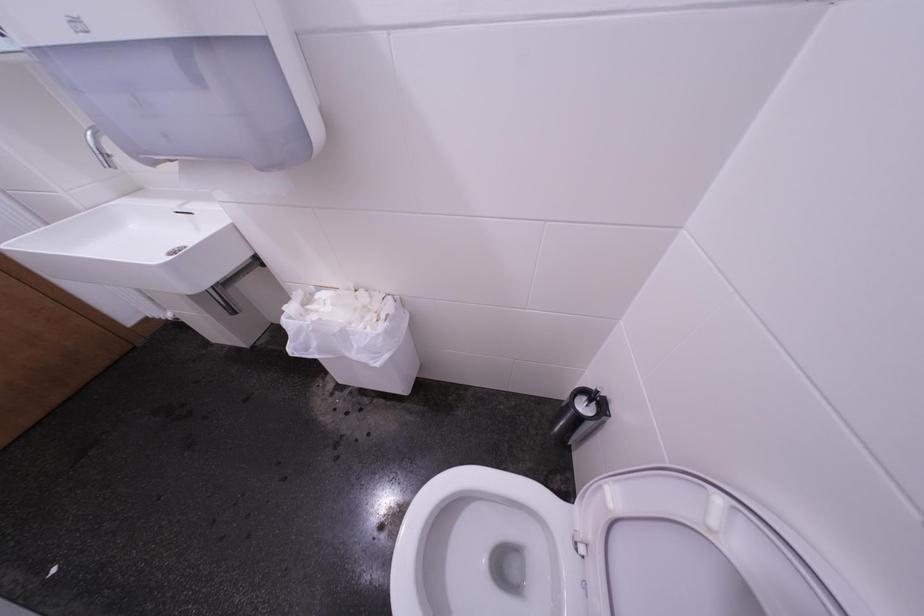
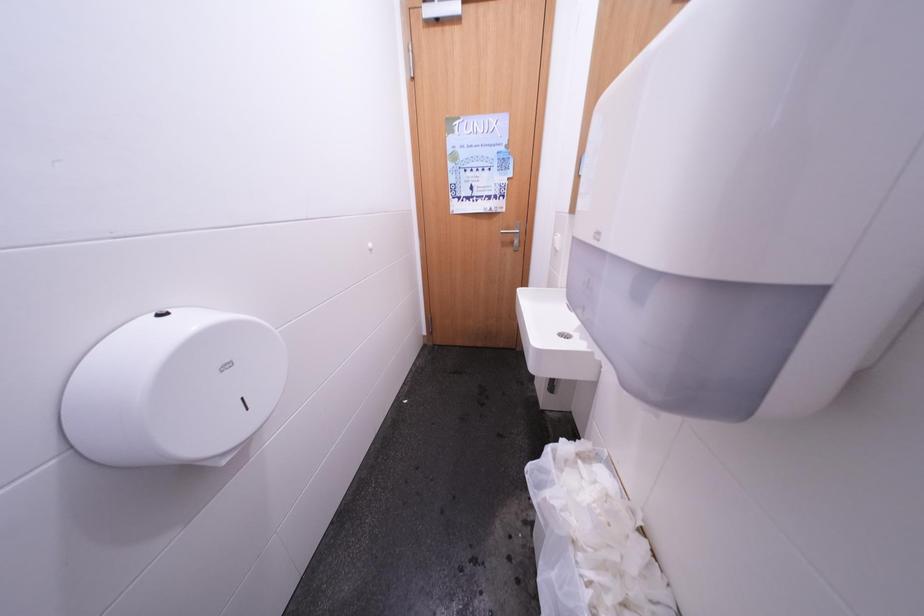
Question: The camera is either moving clockwise (left) or counter-clockwise (right) around the object. The first image is from the beginning of the video and the second image is from the end. Is the camera moving left or right when shooting the video?

Choices:
 (A) Left
 (B) Right

Answer: (B)